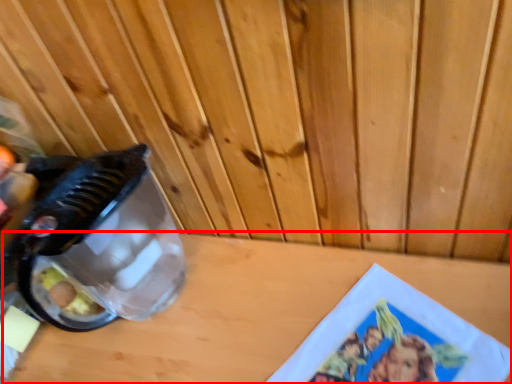
Question: From the image's perspective, where is table top (annotated by the red box) located in relation to appliance in the image?

Choices:
 (A) above
 (B) below

Answer: (B)